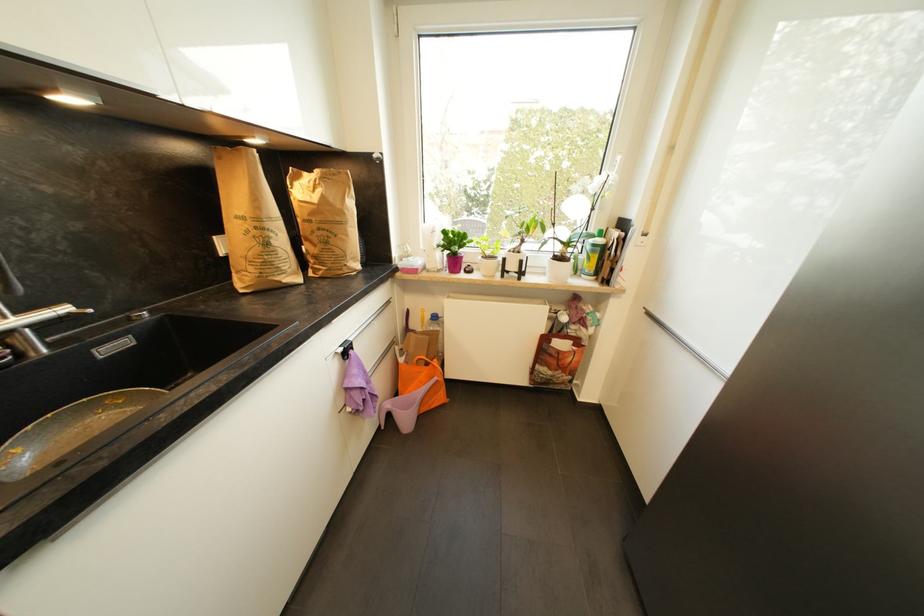
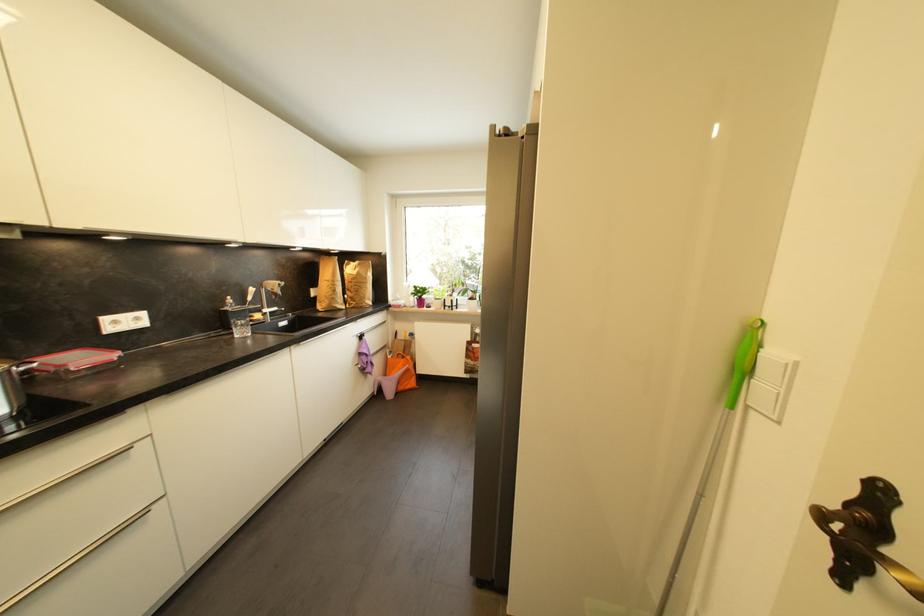
Find the pixel in the second image that matches [317,216] in the first image.

(358, 281)